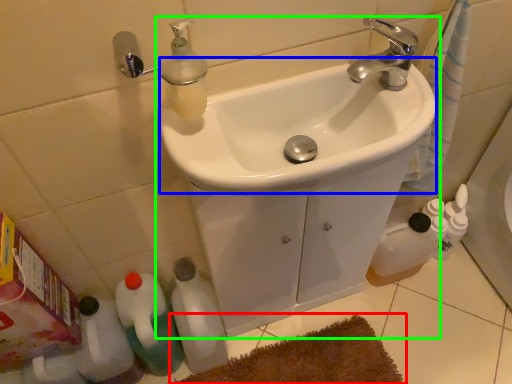
Question: Which object is the closest to the bath mat (highlighted by a red box)? Choose among these: sink (highlighted by a blue box) or sink (highlighted by a green box).

Choices:
 (A) sink
 (B) sink

Answer: (B)